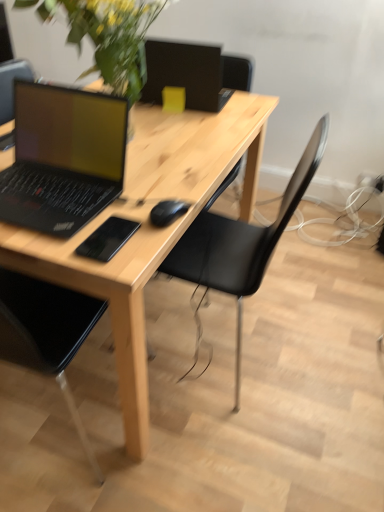
What are the coordinates of `vacant space to the right of black plastic chair at center` in the screenshot? It's located at (332, 348).